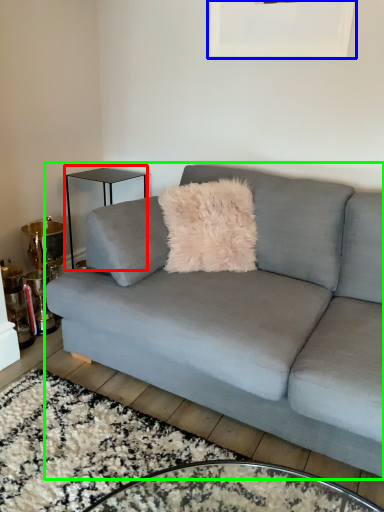
Question: Estimate the real-world distances between objects in this image. Which object is farther from table (highlighted by a red box), picture frame (highlighted by a blue box) or studio couch (highlighted by a green box)?

Choices:
 (A) picture frame
 (B) studio couch

Answer: (B)